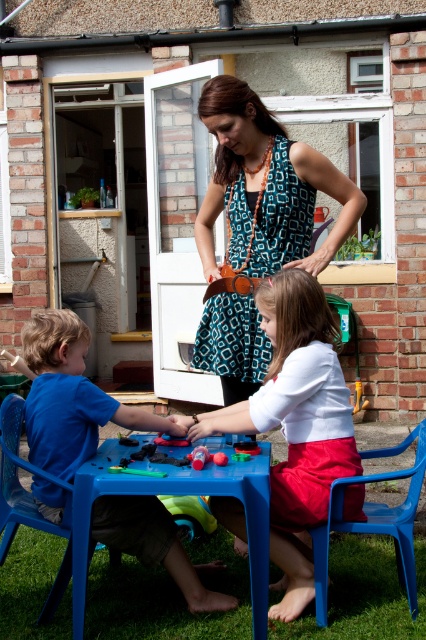
Looking at this image, does teal patterned dress at center appear on the right side of white matte shirt at center?

Correct, you'll find teal patterned dress at center to the right of white matte shirt at center.

You are a GUI agent. You are given a task and a screenshot of the screen. Output one action in this format:
    pyautogui.click(x=<x>, y=<y>)
    Task: Click on the teal patterned dress at center
    
    Given the screenshot: What is the action you would take?
    pyautogui.click(x=265, y=188)

Can you confirm if teal patterned dress at center is taller than blue plastic boy at lower left?

Indeed, teal patterned dress at center has a greater height compared to blue plastic boy at lower left.

Between point (247, 148) and point (46, 368), which one is positioned in front?

Point (46, 368)

What are the coordinates of `teal patterned dress at center` in the screenshot? It's located at coord(265,188).

Is teal patterned dress at center positioned before blue plastic table at center?

No, teal patterned dress at center is behind blue plastic table at center.

Which is behind, point (333, 230) or point (226, 481)?

Positioned behind is point (333, 230).

Is point (219, 172) behind point (172, 474)?

That is True.

Identify the location of teal patterned dress at center. (265, 188).